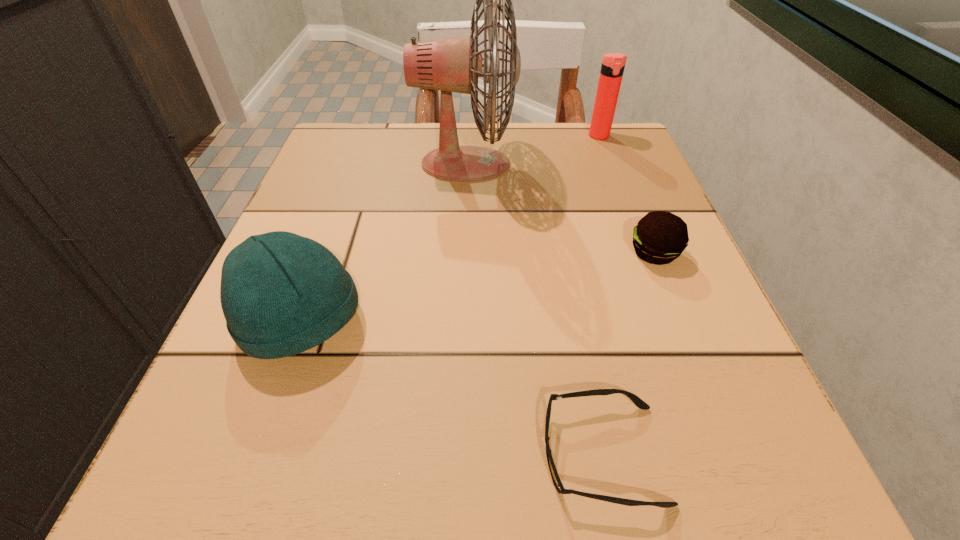
Locate an element on the screen. This screenshot has height=540, width=960. vacant space in between the second shortest object and the spectacles is located at coordinates (628, 353).

At what (x,y) coordinates should I click in order to perform the action: click on vacant point located between the shortest object and the fan. Please return your answer as a coordinate pair (x, y). The width and height of the screenshot is (960, 540). Looking at the image, I should click on (534, 309).

This screenshot has height=540, width=960. In order to click on free space between the nearest object and the second tallest object in this screenshot , I will do `click(601, 295)`.

This screenshot has height=540, width=960. In order to click on vacant area that lies between the tallest object and the spectacles in this screenshot , I will do `click(534, 309)`.

At what (x,y) coordinates should I click in order to perform the action: click on free space that is in between the fourth shortest object and the fan. Please return your answer as a coordinate pair (x, y). Image resolution: width=960 pixels, height=540 pixels. Looking at the image, I should click on (533, 150).

The width and height of the screenshot is (960, 540). Find the location of `free spot between the third nearest object and the thermos bottle`. free spot between the third nearest object and the thermos bottle is located at coordinates (627, 194).

You are a GUI agent. You are given a task and a screenshot of the screen. Output one action in this format:
    pyautogui.click(x=<x>, y=<y>)
    Task: Click on the free space between the tallest object and the leftmost object
    Image resolution: width=960 pixels, height=540 pixels.
    Given the screenshot: What is the action you would take?
    point(384,243)

The height and width of the screenshot is (540, 960). I want to click on vacant area that lies between the shortest object and the leftmost object, so click(x=452, y=388).

Locate an element on the screen. Image resolution: width=960 pixels, height=540 pixels. free point between the leftmost object and the fan is located at coordinates (384, 243).

Find the location of `free spot between the thermos bottle and the leftmost object`. free spot between the thermos bottle and the leftmost object is located at coordinates (450, 229).